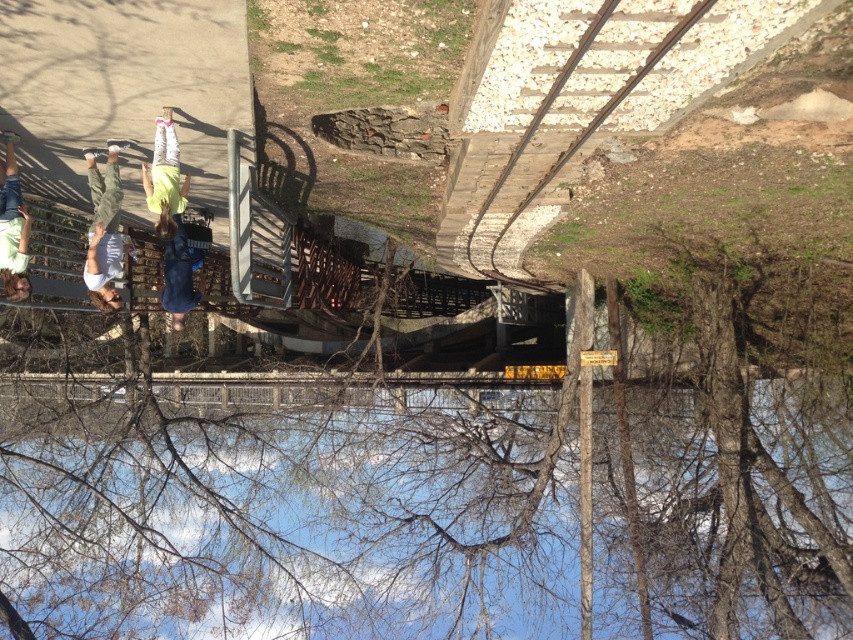
Can you confirm if green fabric pants at left is thinner than light green fabric pants at center?

Correct, green fabric pants at left's width is less than light green fabric pants at center's.

Who is more forward, (88, 275) or (177, 156)?

Point (177, 156)

What are the coordinates of `green fabric pants at left` in the screenshot? It's located at (103, 228).

Can you confirm if wooden planks at upper right is smaller than green fabric pants at left?

No, wooden planks at upper right is not smaller than green fabric pants at left.

This screenshot has height=640, width=853. What do you see at coordinates (587, 124) in the screenshot?
I see `wooden planks at upper right` at bounding box center [587, 124].

Which is behind, point (549, 173) or point (109, 262)?

The point (549, 173) is more distant.

I want to click on wooden planks at upper right, so click(x=587, y=124).

Which is more to the right, light green fabric pants at center or denim shorts at center?

From the viewer's perspective, light green fabric pants at center appears more on the right side.

How distant is light green fabric pants at center from denim shorts at center?

A distance of 63.14 centimeters exists between light green fabric pants at center and denim shorts at center.

Locate an element on the screen. Image resolution: width=853 pixels, height=640 pixels. light green fabric pants at center is located at coordinates (x=164, y=177).